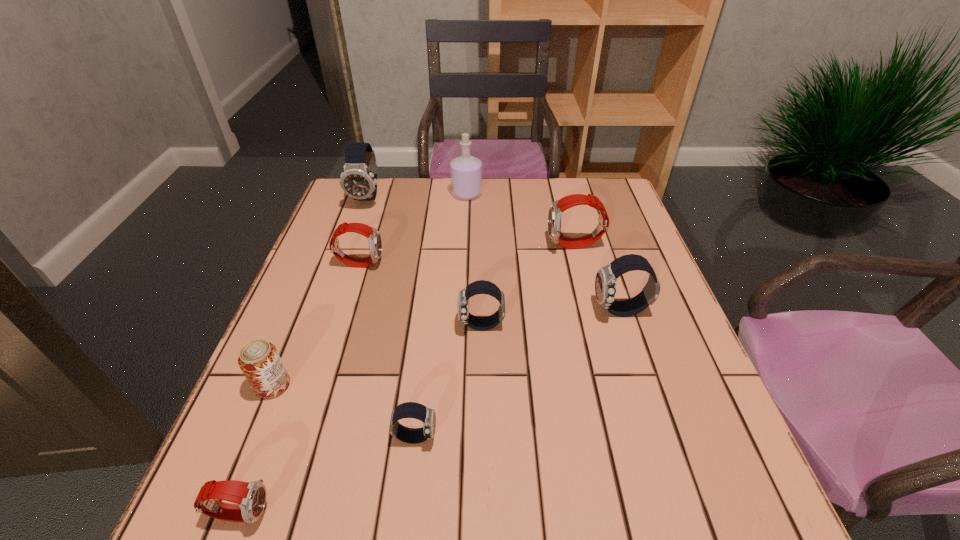
Identify the location of the second nearest object. The height and width of the screenshot is (540, 960). (414, 410).

Identify the location of the nearest watch. (250, 497).

You are a GUI agent. You are given a task and a screenshot of the screen. Output one action in this format:
    pyautogui.click(x=<x>, y=<y>)
    Task: Click on the nearest red watch
    
    Given the screenshot: What is the action you would take?
    pyautogui.click(x=250, y=497)

Locate an element on the screen. The width and height of the screenshot is (960, 540). free space located on the left of the perfume is located at coordinates (353, 194).

In order to click on vacant region located 0.200m on the face of the tallest watch in this screenshot , I will do `click(348, 254)`.

The height and width of the screenshot is (540, 960). What are the coordinates of `free space located on the face of the second biggest dark watch` in the screenshot? It's located at (506, 311).

At what (x,y) coordinates should I click in order to perform the action: click on free location located 0.310m on the face of the second biggest dark watch. Please return your answer as a coordinate pair (x, y). This screenshot has width=960, height=540. Looking at the image, I should click on (459, 311).

Where is `free space located on the face of the second biggest dark watch`? This screenshot has width=960, height=540. free space located on the face of the second biggest dark watch is located at coordinates (515, 311).

Where is `free space located 0.370m on the face of the biggest red watch`? Image resolution: width=960 pixels, height=540 pixels. free space located 0.370m on the face of the biggest red watch is located at coordinates (411, 246).

Find the location of `vacant region located on the face of the biggest red watch`. vacant region located on the face of the biggest red watch is located at coordinates (499, 246).